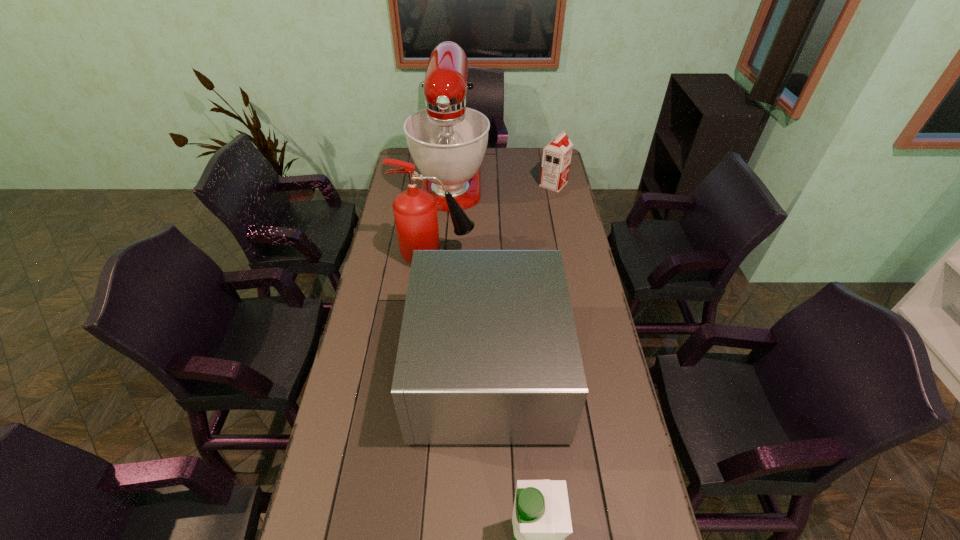
Find the location of a particular element. The height and width of the screenshot is (540, 960). free space located with the door open on the second nearest object is located at coordinates (349, 369).

This screenshot has height=540, width=960. I want to click on vacant space located 0.070m on the left of the farther soya milk, so click(x=524, y=185).

The width and height of the screenshot is (960, 540). Identify the location of object at the far edge. (447, 140).

Where is `mixer present at the left edge`? The image size is (960, 540). mixer present at the left edge is located at coordinates (447, 140).

This screenshot has width=960, height=540. I want to click on fire extinguisher located in the left edge section of the desktop, so click(415, 210).

Find the location of a particular element. The image size is (960, 540). object present at the right edge is located at coordinates point(556,159).

You are a GUI agent. You are given a task and a screenshot of the screen. Output one action in this format:
    pyautogui.click(x=<x>, y=<y>)
    Task: Click on the object that is at the far left corner
    This screenshot has height=540, width=960.
    Given the screenshot: What is the action you would take?
    pyautogui.click(x=447, y=140)

At what (x,y) coordinates should I click in order to perform the action: click on vacant area at the far edge of the desktop. Please return your answer as a coordinate pair (x, y). This screenshot has height=540, width=960. Looking at the image, I should click on (527, 168).

At what (x,y) coordinates should I click in order to perform the action: click on free spot at the left edge of the desktop. Please return your answer as a coordinate pair (x, y). The height and width of the screenshot is (540, 960). Looking at the image, I should click on (349, 492).

The height and width of the screenshot is (540, 960). In order to click on vacant region at the right edge of the desktop in this screenshot , I will do `click(609, 417)`.